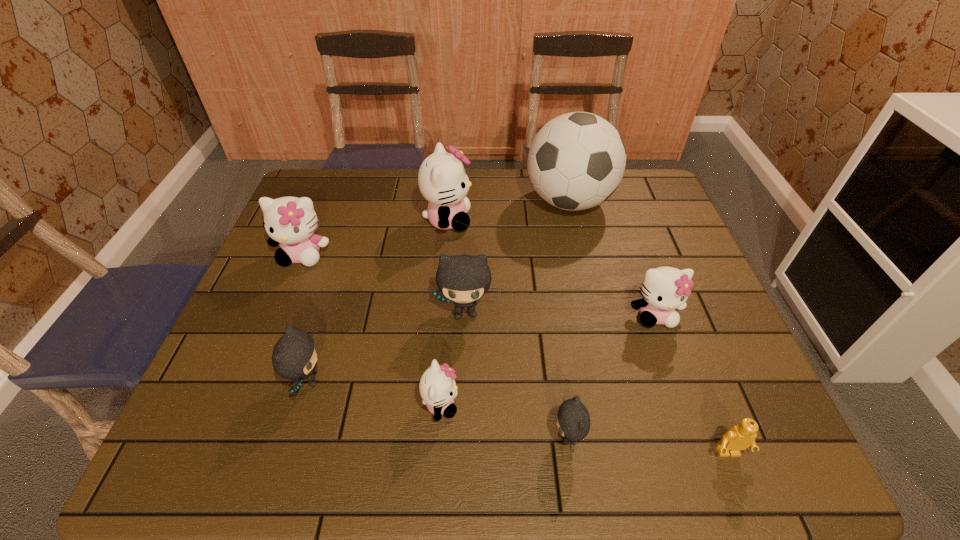
This screenshot has width=960, height=540. I want to click on free space that is in between the second smallest white kitten and the biggest gray kitten, so click(560, 313).

The width and height of the screenshot is (960, 540). I want to click on unoccupied area between the leftmost white kitten and the Lego, so click(516, 354).

Identify the location of empty space that is in between the second smallest white kitten and the black soccer ball. This screenshot has width=960, height=540. (612, 259).

Locate an element on the screen. The image size is (960, 540). empty space between the soccer ball and the rightmost gray kitten is located at coordinates (568, 320).

The image size is (960, 540). What are the coordinates of `free space that is in between the second biggest white kitten and the biggest gray kitten` in the screenshot? It's located at (384, 283).

Identify which object is located as the nearest to the Lego. Please provide its 2D coordinates. Your answer should be formatted as a tuple, i.e. [(x, y)], where the tuple contains the x and y coordinates of a point satisfying the conditions above.

[(573, 422)]

Identify which object is the third nearest to the farthest gray kitten. Please provide its 2D coordinates. Your answer should be formatted as a tuple, i.e. [(x, y)], where the tuple contains the x and y coordinates of a point satisfying the conditions above.

[(442, 179)]

Find the location of `kitten identified as the fifth closest to the second nearest white kitten`. kitten identified as the fifth closest to the second nearest white kitten is located at coordinates click(x=294, y=356).

Locate which kitten ranks in proximity to the Lego. Please provide its 2D coordinates. Your answer should be formatted as a tuple, i.e. [(x, y)], where the tuple contains the x and y coordinates of a point satisfying the conditions above.

[(573, 422)]

Select which white kitten appears as the closest to the Lego. Please provide its 2D coordinates. Your answer should be formatted as a tuple, i.e. [(x, y)], where the tuple contains the x and y coordinates of a point satisfying the conditions above.

[(664, 289)]